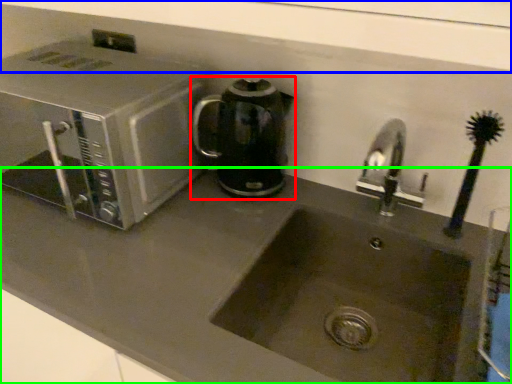
Question: Considering the real-world distances, which object is closest to kitchen appliance (highlighted by a red box)? window sill (highlighted by a blue box) or counter top (highlighted by a green box).

Choices:
 (A) window sill
 (B) counter top

Answer: (B)